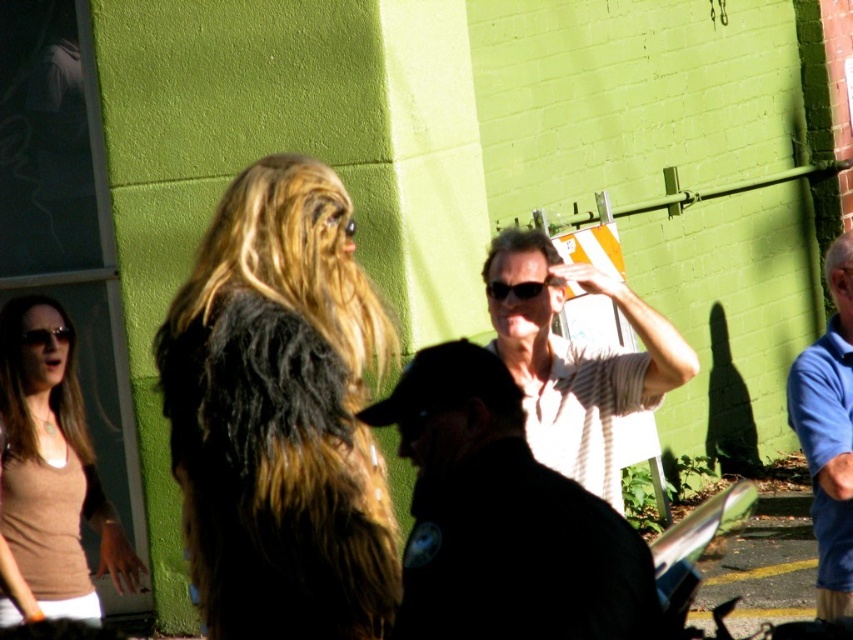
Question: Does shaggy fur coat at center appear under gray fuzzy hair at upper right?

Choices:
 (A) yes
 (B) no

Answer: (A)

Question: Among these objects, which one is farthest from the camera?

Choices:
 (A) brown matte shirt at left
 (B) gray fuzzy hair at upper right
 (C) blonde hair at center
 (D) black plastic sunglasses at center

Answer: (B)

Question: Is striped cotton shirt at center smaller than gray fuzzy hair at upper right?

Choices:
 (A) yes
 (B) no

Answer: (B)

Question: Which object appears farthest from the camera in this image?

Choices:
 (A) blonde silky hair at lower left
 (B) white striped shirt at center
 (C) shaggy fur coat at center

Answer: (A)

Question: Considering the relative positions of blonde silky hair at lower left and black plastic sunglasses at center in the image provided, where is blonde silky hair at lower left located with respect to black plastic sunglasses at center?

Choices:
 (A) below
 (B) above

Answer: (A)

Question: Which object is closer to the camera taking this photo?

Choices:
 (A) blonde silky hair at lower left
 (B) blonde hair at center

Answer: (B)